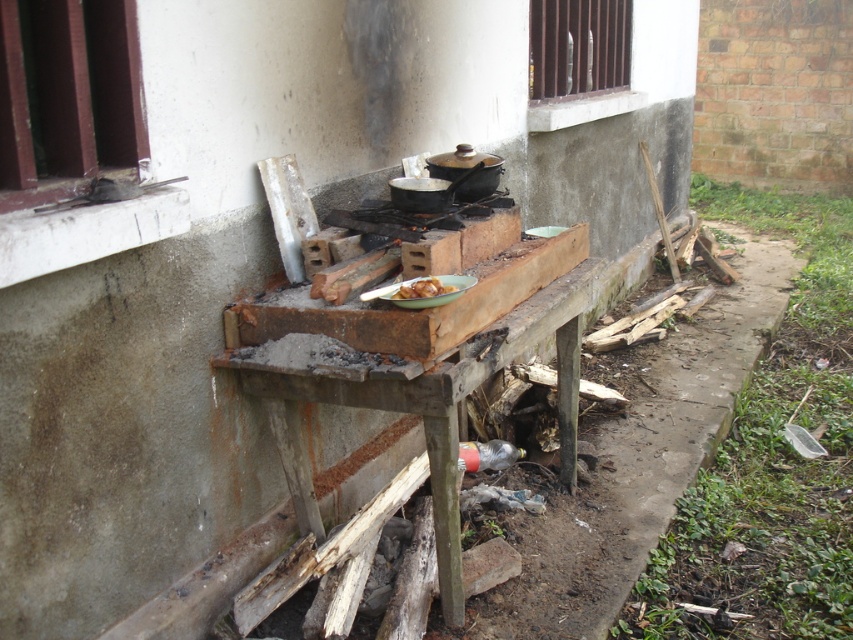
You are standing at the entrance of the outdoor cooking area. You need to place a new pot on the rusty wooden table at center. Where exactly should you place it?

You should place the new pot at point (422, 432) on the rusty wooden table at center as that is its exact location.